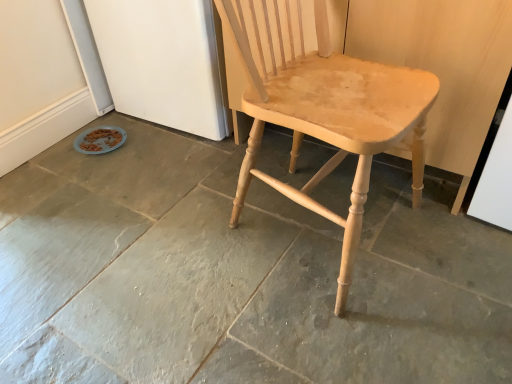
This screenshot has height=384, width=512. I want to click on vacant space to the left of natural wood chair at center, so click(x=170, y=250).